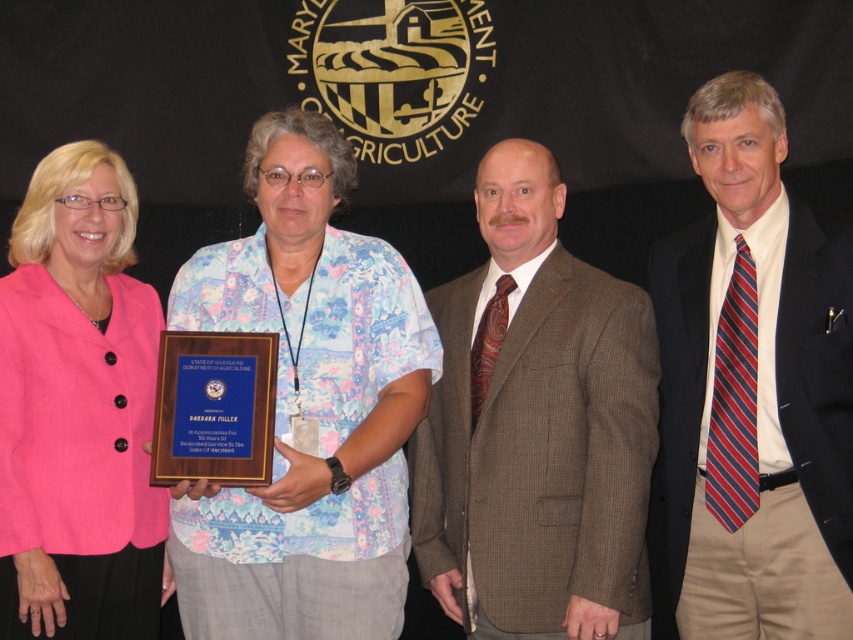
Does brown textured suit at center have a smaller size compared to floral fabric shirt at center?

No.

Find the location of a particular element. The width and height of the screenshot is (853, 640). brown textured suit at center is located at coordinates (537, 426).

Is floral fabric shirt at center taller than pink fabric jacket at left?

Indeed, floral fabric shirt at center has a greater height compared to pink fabric jacket at left.

Identify the location of floral fabric shirt at center. (306, 406).

Does striped tie at center appear on the left side of pink fabric jacket at left?

No, striped tie at center is not to the left of pink fabric jacket at left.

Does point (825, 387) lie behind point (68, 490)?

That is False.

Where is `striped tie at center`? striped tie at center is located at coordinates (753, 387).